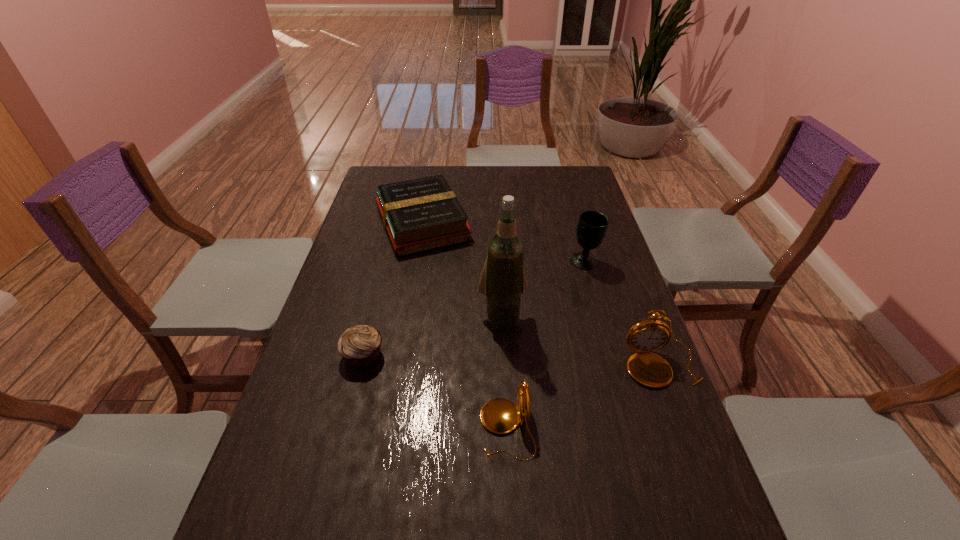
The width and height of the screenshot is (960, 540). I want to click on the shorter pocket watch, so click(x=499, y=415).

You are a GUI agent. You are given a task and a screenshot of the screen. Output one action in this format:
    pyautogui.click(x=<x>, y=<y>)
    Task: Click on the nearest object
    Image resolution: width=960 pixels, height=540 pixels.
    Given the screenshot: What is the action you would take?
    pyautogui.click(x=499, y=415)

You are a GUI agent. You are given a task and a screenshot of the screen. Output one action in this format:
    pyautogui.click(x=<x>, y=<y>)
    Task: Click on the taller pocket watch
    The width and height of the screenshot is (960, 540).
    Given the screenshot: What is the action you would take?
    pyautogui.click(x=649, y=369)

The image size is (960, 540). Identify the location of the farther pocket watch. (649, 369).

Where is `muffin`? The image size is (960, 540). muffin is located at coordinates (359, 346).

Where is `the third farthest object`? the third farthest object is located at coordinates (503, 279).

In order to click on the tallest object in this screenshot , I will do click(x=503, y=279).

Where is `hardback book`? This screenshot has height=540, width=960. hardback book is located at coordinates (419, 215).

Identify the location of chalice. This screenshot has width=960, height=540. (x=592, y=226).

In order to click on vacant region located 0.300m on the face of the shorter pocket watch in this screenshot , I will do `click(346, 429)`.